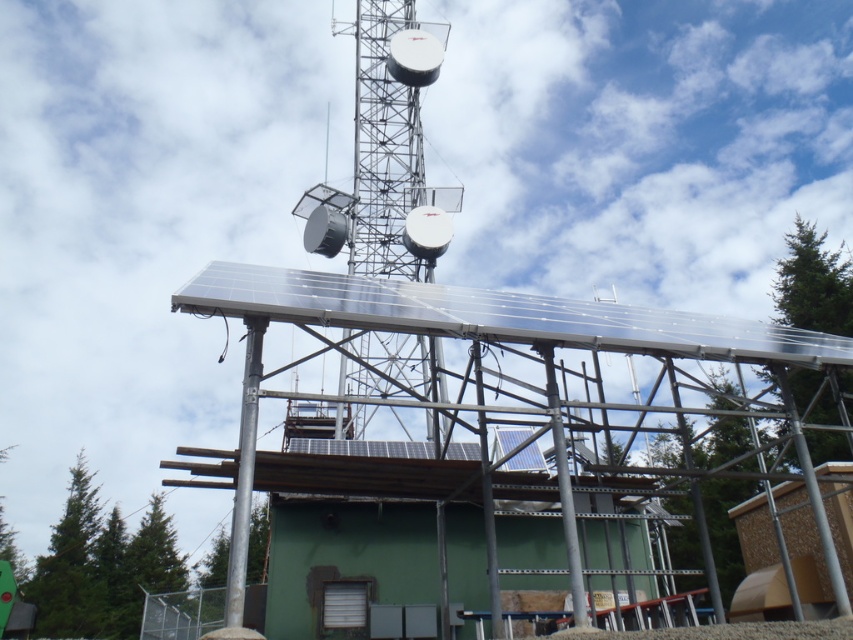
You are a construction worker standing at the base of the metallic silver tower at center. You need to reach the transparent glass solar panel at upper center for maintenance. Given that your ladder can extend up to 15 meters, will you be able to reach it?

The distance between the transparent glass solar panel at upper center and the metallic silver tower at center is 16.33 meters. Since the ladder can only extend up to 15 meters, you will not be able to reach the solar panel with the current ladder.

You are an inspector checking the construction site. You notice the transparent glass solar panel at upper center and the silver metallic pole at center. Which object has a greater width?

The transparent glass solar panel at upper center has a greater width than the silver metallic pole at center.

You are standing at the construction site and want to determine the relative positions of two points marked on the blueprint. The points are labeled as point 1 at coordinates point (415, 339) and point 2 at coordinates point (233, 509). Which point is closer to you?

Point (415, 339) is further to the viewer than point (233, 509), so point (233, 509) is closer to you.